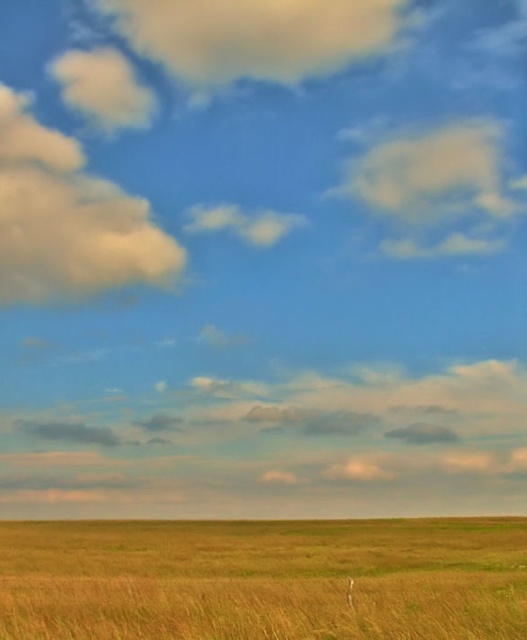
Question: Which object appears closest to the camera in this image?

Choices:
 (A) golden grassland at lower center
 (B) cloudy sky at upper left
 (C) cloudy sky at upper center

Answer: (A)

Question: Which object is farther from the camera taking this photo?

Choices:
 (A) cloudy cotton cloud at upper right
 (B) cloudy sky at upper left

Answer: (A)

Question: Is golden grassland at lower center wider than cloudy sky at upper center?

Choices:
 (A) yes
 (B) no

Answer: (A)

Question: Is the position of cloudy sky at upper center more distant than that of cloudy cotton cloud at upper right?

Choices:
 (A) yes
 (B) no

Answer: (A)

Question: Which point is farther from the camera taking this photo?

Choices:
 (A) (82, 636)
 (B) (388, 252)
 (C) (69, 291)

Answer: (C)

Question: Can you confirm if cloudy sky at upper left is positioned to the right of cloudy cotton cloud at upper right?

Choices:
 (A) no
 (B) yes

Answer: (A)